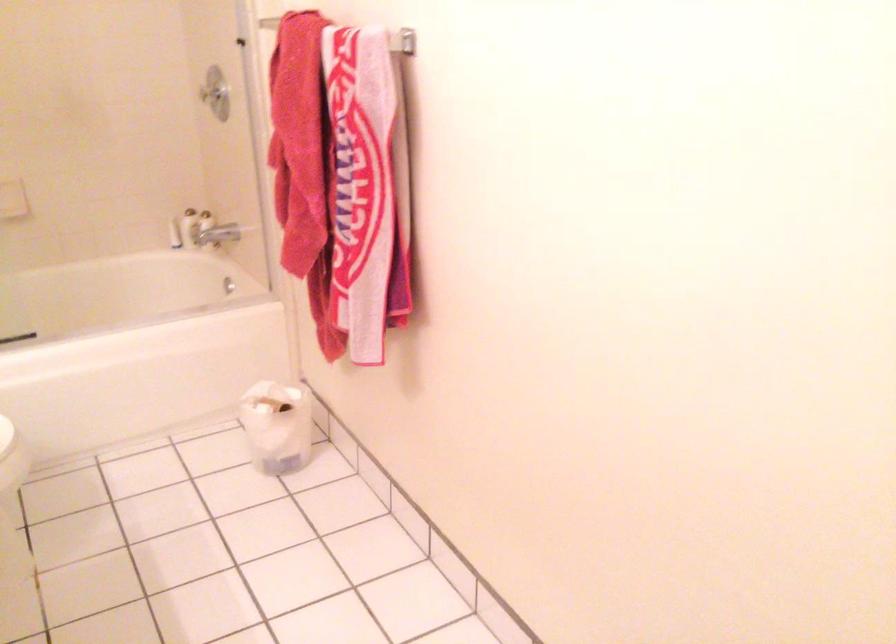
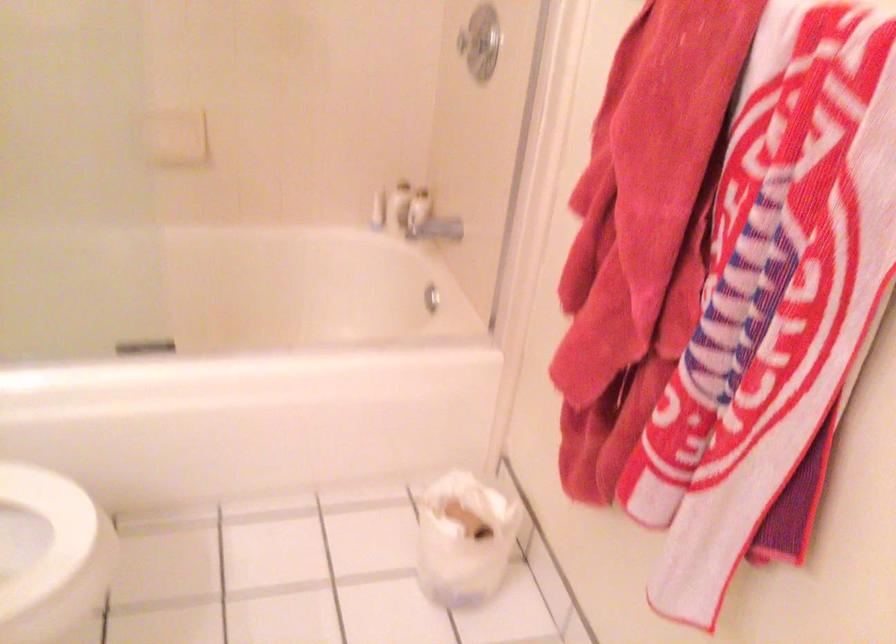
The point at (218, 93) is marked in the first image. Where is the corresponding point in the second image?

(478, 42)